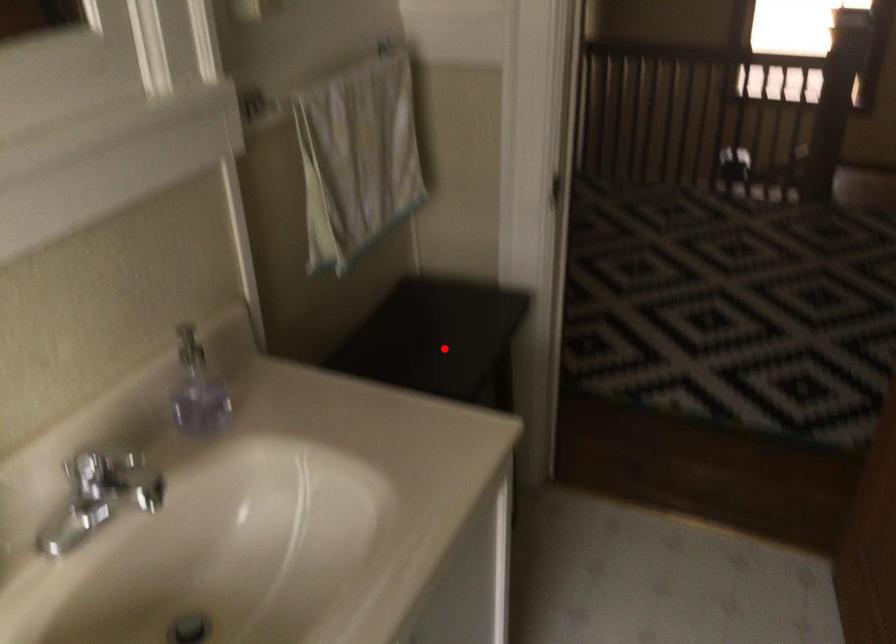
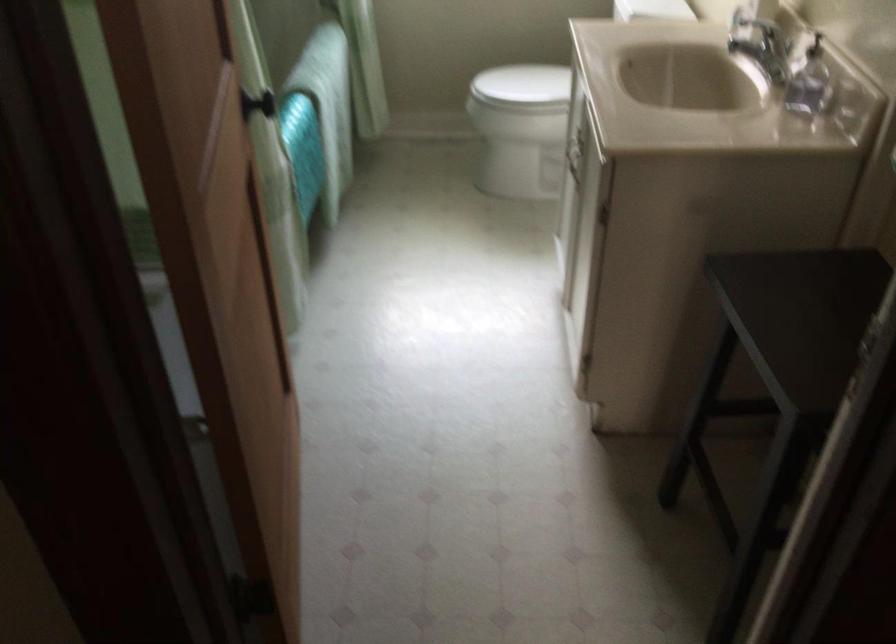
Question: I am providing you with two images of the same scene from different viewpoints. In image1, a red point is highlighted. Considering the same 3D point in image2, which of the following is correct?

Choices:
 (A) It is closer
 (B) It is farther

Answer: (A)